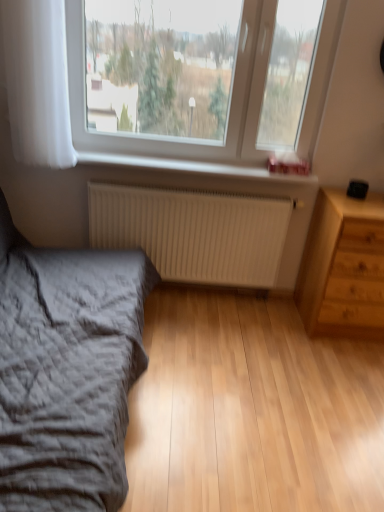
You are a GUI agent. You are given a task and a screenshot of the screen. Output one action in this format:
    pyautogui.click(x=<x>, y=<y>)
    Task: Click on the empty space that is ontop of white matte radiator at lower center
    This screenshot has width=384, height=512.
    Given the screenshot: What is the action you would take?
    pyautogui.click(x=200, y=188)